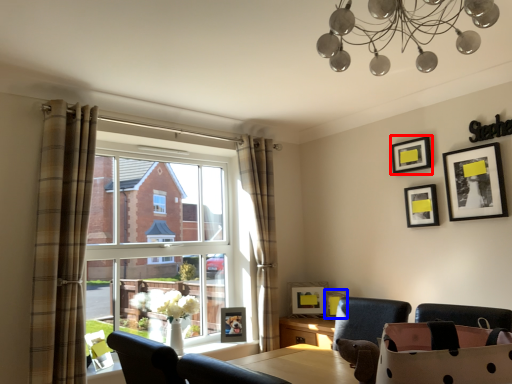
Question: Which object appears farthest to the camera in this image, picture frame (highlighted by a red box) or picture frame (highlighted by a blue box)?

Choices:
 (A) picture frame
 (B) picture frame

Answer: (B)